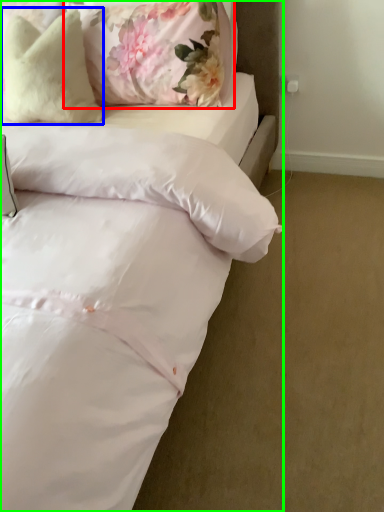
Question: Considering the real-world distances, which object is closest to pillow (highlighted by a red box)? pillow (highlighted by a blue box) or bed (highlighted by a green box).

Choices:
 (A) pillow
 (B) bed

Answer: (A)